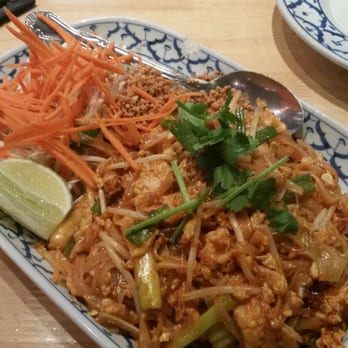
This screenshot has width=348, height=348. Find the location of `shadow of tray`. shadow of tray is located at coordinates (47, 312).